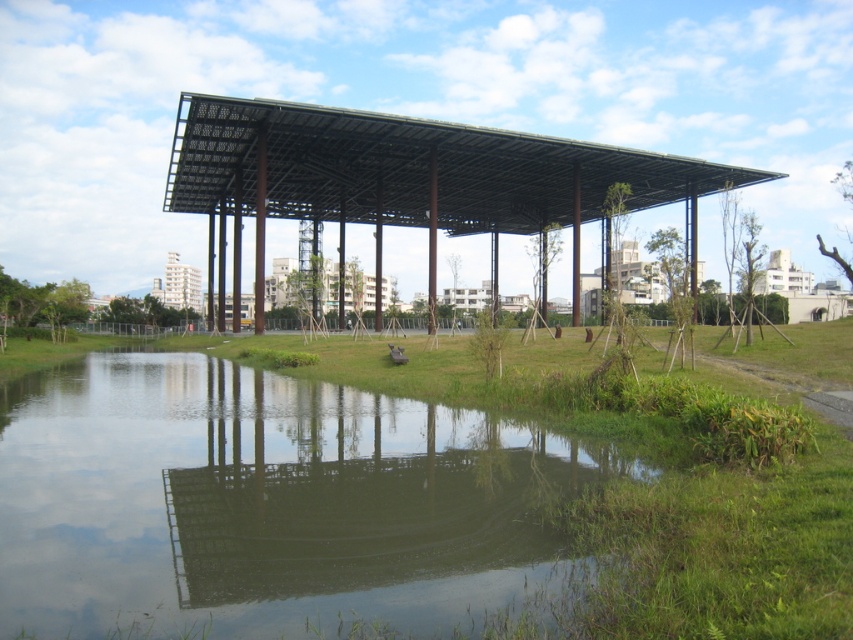
Is transparent water at center bigger than black metal/pergola at center?

Actually, transparent water at center might be smaller than black metal/pergola at center.

Between transparent water at center and black metal/pergola at center, which one is positioned lower?

transparent water at center is lower down.

Which is in front, point (22, 628) or point (386, 182)?

Point (22, 628) is in front.

Where is `transparent water at center`? Image resolution: width=853 pixels, height=640 pixels. transparent water at center is located at coordinates (265, 502).